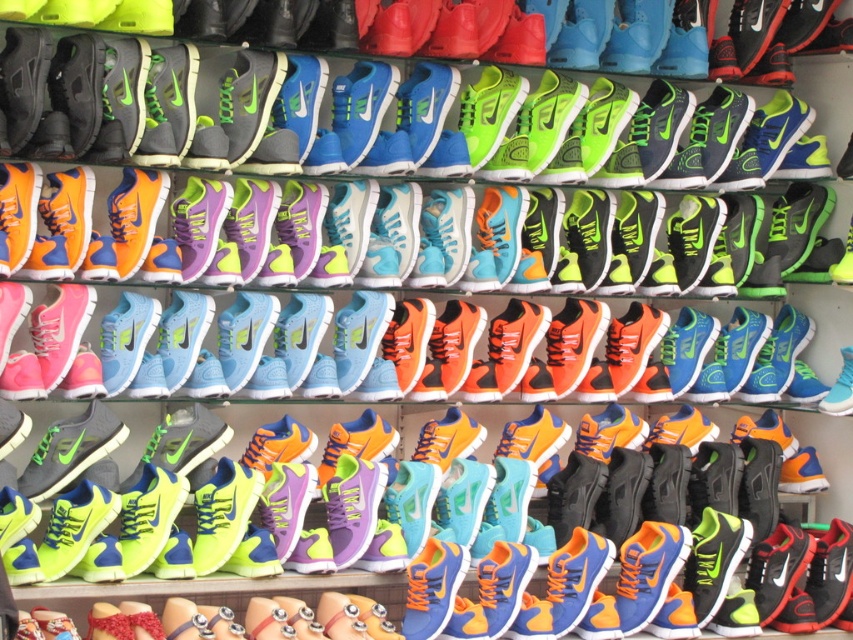
You are an athlete trying to choose between the matte purple sneaker at center and the shiny blue sneakers at center for a race. Considering their widths, which pair might be more comfortable for your narrow feet?

The matte purple sneaker at center is thinner than the shiny blue sneakers at center, so it would be more comfortable for narrow feet.

Based on the photo, you are an athlete looking to choose a pair of shoes from the shelf. You see a matte purple sneaker at center. Based on its position, can you tell me which row it is located in?

The matte purple sneaker at center is located in the third row from the top.